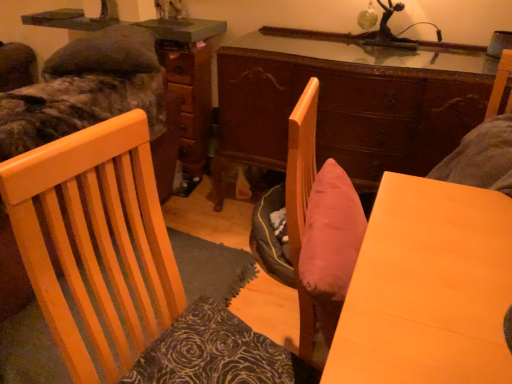
Where is `wooden table at center`? wooden table at center is located at coordinates click(428, 289).

What is the approximate width of wooden chair at center?

50.47 centimeters.

You are a GUI agent. You are given a task and a screenshot of the screen. Output one action in this format:
    pyautogui.click(x=<x>, y=<y>)
    Task: Click on the wooden chair at center
    
    Given the screenshot: What is the action you would take?
    pyautogui.click(x=100, y=258)

I want to click on wooden dresser at center, so click(191, 100).

Which object is wider, velvet green bed at upper left, arranged as the second bed when viewed from the top, or wooden desk at center?

velvet green bed at upper left, arranged as the second bed when viewed from the top, is wider.

Which is behind, point (128, 58) or point (265, 131)?

Point (265, 131)

Starting from the wooden desk at center, which bed is the 2nd one to the left? Please provide its 2D coordinates.

[(86, 90)]

From the image's perspective, is velvet green bed at upper left, arranged as the second bed when viewed from the top, above or below wooden desk at center?

Based on their image positions, velvet green bed at upper left, arranged as the second bed when viewed from the top, is located beneath wooden desk at center.

Are wooden chair at center and camouflage fabric bed at upper left, acting as the second bed starting from the bottom, located far from each other?

wooden chair at center is near camouflage fabric bed at upper left, acting as the second bed starting from the bottom, not far away.

Is wooden chair at center wider or thinner than camouflage fabric bed at upper left, arranged as the first bed when viewed from the top?

In the image, wooden chair at center appears to be more narrow than camouflage fabric bed at upper left, arranged as the first bed when viewed from the top.

From a real-world perspective, is wooden chair at center on camouflage fabric bed at upper left, acting as the second bed starting from the bottom?

No, from a real-world perspective, wooden chair at center is not over camouflage fabric bed at upper left, acting as the second bed starting from the bottom

Is wooden chair at center positioned with its back to camouflage fabric bed at upper left, arranged as the first bed when viewed from the top?

wooden chair at center does not have its back to camouflage fabric bed at upper left, arranged as the first bed when viewed from the top.

Between point (428, 353) and point (0, 94), which one is positioned behind?

The point (0, 94) is farther.

Considering the relative sizes of wooden table at center and camouflage fabric bed at upper left, arranged as the first bed when viewed from the top, in the image provided, is wooden table at center wider than camouflage fabric bed at upper left, arranged as the first bed when viewed from the top,?

Yes.

From a real-world perspective, is wooden table at center physically below camouflage fabric bed at upper left, acting as the second bed starting from the bottom?

Yes, from a real-world perspective, wooden table at center is below camouflage fabric bed at upper left, acting as the second bed starting from the bottom.

Based on the photo, considering the relative sizes of wooden table at center and camouflage fabric bed at upper left, arranged as the first bed when viewed from the top, in the image provided, is wooden table at center smaller than camouflage fabric bed at upper left, arranged as the first bed when viewed from the top,?

Incorrect, wooden table at center is not smaller in size than camouflage fabric bed at upper left, arranged as the first bed when viewed from the top.

Where is `desk in front of the wooden dresser at center`? The width and height of the screenshot is (512, 384). desk in front of the wooden dresser at center is located at coordinates (351, 102).

How far apart are wooden desk at center and wooden dresser at center?

wooden desk at center and wooden dresser at center are 27.86 inches apart.

Considering the positions of objects wooden desk at center and wooden dresser at center in the image provided, who is in front, wooden desk at center or wooden dresser at center?

Positioned in front is wooden desk at center.

Is wooden dresser at center a part of wooden desk at center?

No, wooden dresser at center is not inside wooden desk at center.

Considering the relative sizes of wooden dresser at center and dark brown textured pillow at lower left in the image provided, is wooden dresser at center smaller than dark brown textured pillow at lower left?

Actually, wooden dresser at center might be larger than dark brown textured pillow at lower left.

Considering the relative sizes of wooden dresser at center and dark brown textured pillow at lower left in the image provided, is wooden dresser at center shorter than dark brown textured pillow at lower left?

No.

In the scene shown: Considering the positions of objects wooden dresser at center and dark brown textured pillow at lower left in the image provided, who is in front, wooden dresser at center or dark brown textured pillow at lower left?

dark brown textured pillow at lower left is in front.

Would you say wooden dresser at center is outside dark brown textured pillow at lower left?

Yes, wooden dresser at center is outside of dark brown textured pillow at lower left.

Is camouflage fabric bed at upper left, acting as the second bed starting from the bottom, not close to wooden chair at center?

No, camouflage fabric bed at upper left, acting as the second bed starting from the bottom, is not far away from wooden chair at center.

From a real-world perspective, is camouflage fabric bed at upper left, arranged as the first bed when viewed from the top, located higher than wooden chair at center?

Yes, from a real-world perspective, camouflage fabric bed at upper left, arranged as the first bed when viewed from the top, is above wooden chair at center.

Is camouflage fabric bed at upper left, acting as the second bed starting from the bottom, facing towards wooden chair at center?

No, camouflage fabric bed at upper left, acting as the second bed starting from the bottom, is not oriented towards wooden chair at center.

Does point (53, 125) come behind point (187, 120)?

No, it is in front of (187, 120).

Is velvet green bed at upper left, the first bed from the bottom, bigger than wooden dresser at center?

Yes.

From a real-world perspective, is velvet green bed at upper left, the first bed from the bottom, under wooden dresser at center?

Yes, from a real-world perspective, velvet green bed at upper left, the first bed from the bottom, is under wooden dresser at center.

Does velvet green bed at upper left, the first bed from the bottom, have a lesser width compared to wooden dresser at center?

No.

What are the coordinates of `desk above the velvet green bed at upper left, arranged as the second bed when viewed from the top (from the image's perspective)` in the screenshot? It's located at (351, 102).

Where is `chair beneath the camouflage fabric bed at upper left, acting as the second bed starting from the bottom (from a real-world perspective)`? chair beneath the camouflage fabric bed at upper left, acting as the second bed starting from the bottom (from a real-world perspective) is located at coordinates (100, 258).

Looking at the image, which one is located further to wooden table at center, dark brown textured pillow at lower left or wooden dresser at center?

Based on the image, wooden dresser at center appears to be further to wooden table at center.

Based on their spatial positions, is velvet green bed at upper left, the first bed from the bottom, or dark brown textured pillow at lower left closer to wooden dresser at center?

Among the two, velvet green bed at upper left, the first bed from the bottom, is located nearer to wooden dresser at center.

Looking at this image, looking at the image, which one is located further to camouflage fabric bed at upper left, arranged as the first bed when viewed from the top, wooden dresser at center or wooden table at center?

The object further to camouflage fabric bed at upper left, arranged as the first bed when viewed from the top, is wooden table at center.

Looking at the image, which one is located closer to camouflage fabric bed at upper left, arranged as the first bed when viewed from the top, wooden table at center or wooden dresser at center?

wooden dresser at center is positioned closer to the anchor camouflage fabric bed at upper left, arranged as the first bed when viewed from the top.

From the image, which object appears to be farther from dark brown textured pillow at lower left, wooden chair at center or wooden table at center?

Among the two, wooden table at center is located further to dark brown textured pillow at lower left.

In the scene shown: Considering their positions, is wooden desk at center positioned further to dark brown textured pillow at lower left than wooden table at center?

Based on the image, wooden desk at center appears to be further to dark brown textured pillow at lower left.

Considering their positions, is wooden dresser at center positioned closer to velvet green bed at upper left, arranged as the second bed when viewed from the top, than dark brown textured pillow at lower left?

wooden dresser at center.

From the image, which object appears to be nearer to velvet green bed at upper left, the first bed from the bottom, wooden table at center or dark brown textured pillow at lower left?

The object closer to velvet green bed at upper left, the first bed from the bottom, is dark brown textured pillow at lower left.

What are the coordinates of `pillow situated between wooden chair at center and wooden table at center from left to right` in the screenshot? It's located at (213, 352).

The width and height of the screenshot is (512, 384). What are the coordinates of `pillow between camouflage fabric bed at upper left, acting as the second bed starting from the bottom, and wooden table at center in the up-down direction` in the screenshot? It's located at (213, 352).

The height and width of the screenshot is (384, 512). Find the location of `pillow between wooden table at center and wooden desk at center from front to back`. pillow between wooden table at center and wooden desk at center from front to back is located at coordinates (213, 352).

The height and width of the screenshot is (384, 512). Find the location of `chair between velvet green bed at upper left, arranged as the second bed when viewed from the top, and wooden desk at center from left to right`. chair between velvet green bed at upper left, arranged as the second bed when viewed from the top, and wooden desk at center from left to right is located at coordinates (100, 258).